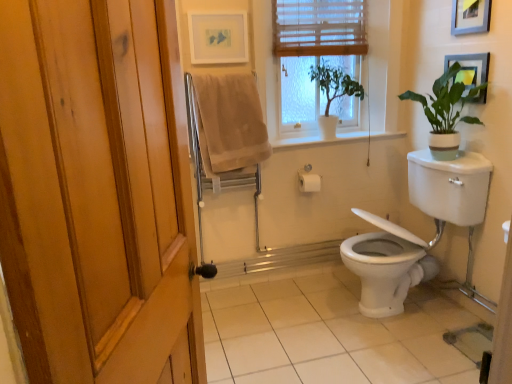
Locate an element on the screen. This screenshot has width=512, height=384. free location to the left of white glossy toilet at lower right is located at coordinates (312, 329).